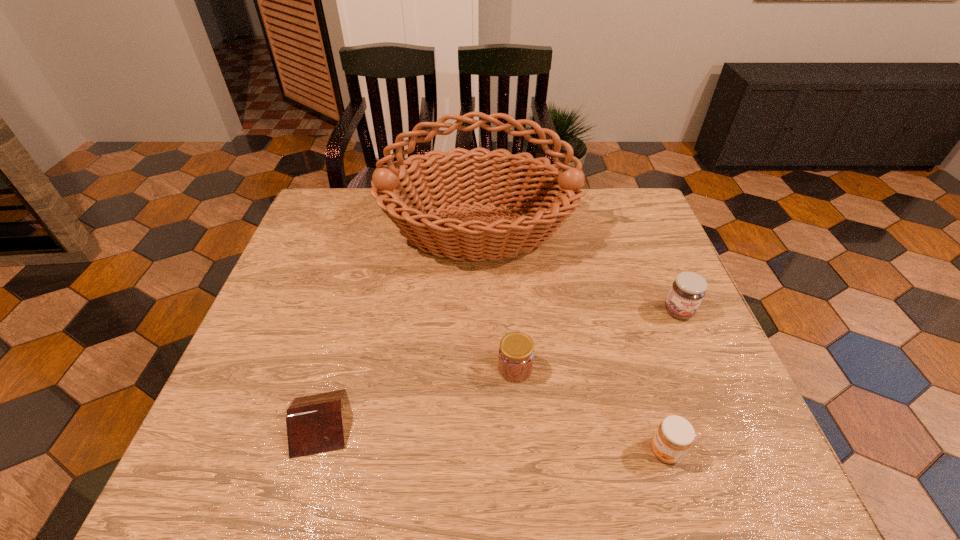
Identify the location of object present at the near left corner. (314, 423).

I want to click on object located at the near right corner, so click(674, 436).

In the image, there is a desktop. Identify the location of free space at the far edge. (573, 213).

In order to click on free spot at the near edge of the desktop in this screenshot , I will do `click(369, 443)`.

I want to click on vacant region at the left edge of the desktop, so click(x=234, y=376).

At what (x,y) coordinates should I click in order to perform the action: click on free region at the right edge of the desktop. Please return your answer as a coordinate pair (x, y). The image size is (960, 540). Looking at the image, I should click on (696, 421).

Find the location of a particular element. vacant area at the far left corner is located at coordinates (341, 204).

Find the location of `free space at the far right corner`. free space at the far right corner is located at coordinates (637, 191).

At what (x,y) coordinates should I click in order to perform the action: click on unoccupied area between the shortest object and the farthest object. Please return your answer as a coordinate pair (x, y). The width and height of the screenshot is (960, 540). Looking at the image, I should click on (398, 327).

This screenshot has width=960, height=540. I want to click on unoccupied position between the book and the second jam from left to right, so click(x=492, y=437).